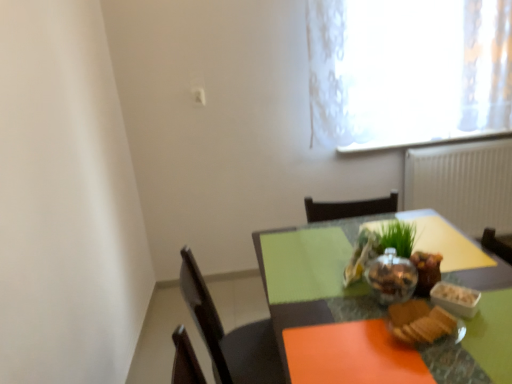
Question: From the image's perspective, is slightly toasted bread at lower right, the first food in the front-to-back sequence, above matte glass bowl at center?

Choices:
 (A) yes
 (B) no

Answer: (A)

Question: Is slightly toasted bread at lower right, acting as the third food starting from the back, at the right side of matte glass bowl at center?

Choices:
 (A) no
 (B) yes

Answer: (A)

Question: From a real-world perspective, is slightly toasted bread at lower right, the first food in the front-to-back sequence, over matte glass bowl at center?

Choices:
 (A) no
 (B) yes

Answer: (B)

Question: Does slightly toasted bread at lower right, the first food in the front-to-back sequence, touch matte glass bowl at center?

Choices:
 (A) no
 (B) yes

Answer: (A)

Question: Does slightly toasted bread at lower right, the first food in the front-to-back sequence, have a lesser height compared to matte glass bowl at center?

Choices:
 (A) yes
 (B) no

Answer: (A)

Question: From a real-world perspective, is white textured radiator at right physically located above or below slightly toasted bread at lower right, the first food in the front-to-back sequence?

Choices:
 (A) above
 (B) below

Answer: (B)

Question: From their relative heights in the image, would you say white textured radiator at right is taller or shorter than slightly toasted bread at lower right, the first food in the front-to-back sequence?

Choices:
 (A) short
 (B) tall

Answer: (B)

Question: Is white textured radiator at right wider or thinner than slightly toasted bread at lower right, the first food in the front-to-back sequence?

Choices:
 (A) thin
 (B) wide

Answer: (A)

Question: In terms of size, does white textured radiator at right appear bigger or smaller than slightly toasted bread at lower right, acting as the third food starting from the back?

Choices:
 (A) small
 (B) big

Answer: (B)

Question: Is white textured radiator at right bigger or smaller than shiny metallic bowl at center, which is the third food from front to back?

Choices:
 (A) small
 (B) big

Answer: (B)

Question: Is white textured radiator at right situated inside shiny metallic bowl at center, the first food positioned from the back, or outside?

Choices:
 (A) outside
 (B) inside

Answer: (A)

Question: From their relative heights in the image, would you say white textured radiator at right is taller or shorter than shiny metallic bowl at center, the first food positioned from the back?

Choices:
 (A) tall
 (B) short

Answer: (A)

Question: Considering their positions, is white textured radiator at right located in front of or behind shiny metallic bowl at center, the first food positioned from the back?

Choices:
 (A) front
 (B) behind

Answer: (B)

Question: Would you say shiny metallic bowl at center, the second food from the front, is to the left or to the right of green glass table at center in the picture?

Choices:
 (A) right
 (B) left

Answer: (B)

Question: Is shiny metallic bowl at center, the second food from the front, inside the boundaries of green glass table at center, or outside?

Choices:
 (A) inside
 (B) outside

Answer: (B)